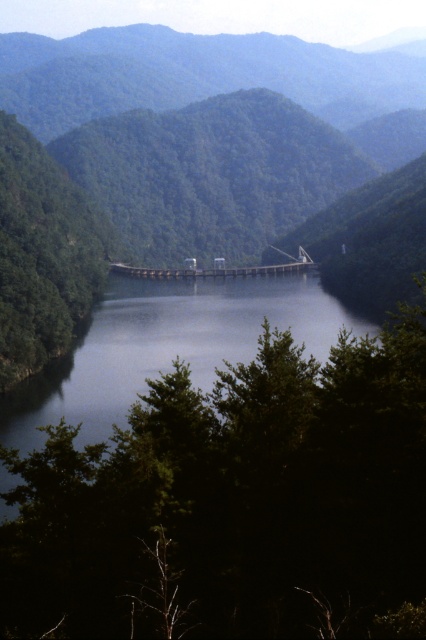
Who is higher up, green matte tree at center or concrete bridge at center?

Positioned higher is green matte tree at center.

From the picture: Measure the distance between green matte tree at center and camera.

780.18 feet

You are a GUI agent. You are given a task and a screenshot of the screen. Output one action in this format:
    pyautogui.click(x=<x>, y=<y>)
    Task: Click on the green matte tree at center
    This screenshot has height=640, width=426.
    Given the screenshot: What is the action you would take?
    [x=43, y=253]

The width and height of the screenshot is (426, 640). Describe the element at coordinates (235, 502) in the screenshot. I see `green leafy tree at center` at that location.

Does green leafy tree at center appear under concrete bridge at center?

Yes.

Is point (204, 432) in front of point (218, 268)?

Yes, it is in front of point (218, 268).

You are a GUI agent. You are given a task and a screenshot of the screen. Output one action in this format:
    pyautogui.click(x=<x>, y=<y>)
    Task: Click on the green leafy tree at center
    This screenshot has width=426, height=640.
    Given the screenshot: What is the action you would take?
    pyautogui.click(x=235, y=502)

Which of these two, green leafy tree at center or green matte tree at center, stands taller?

With more height is green matte tree at center.

Does green leafy tree at center appear over green matte tree at center?

No, green leafy tree at center is not above green matte tree at center.

Where is `green leafy tree at center`? green leafy tree at center is located at coordinates (235, 502).